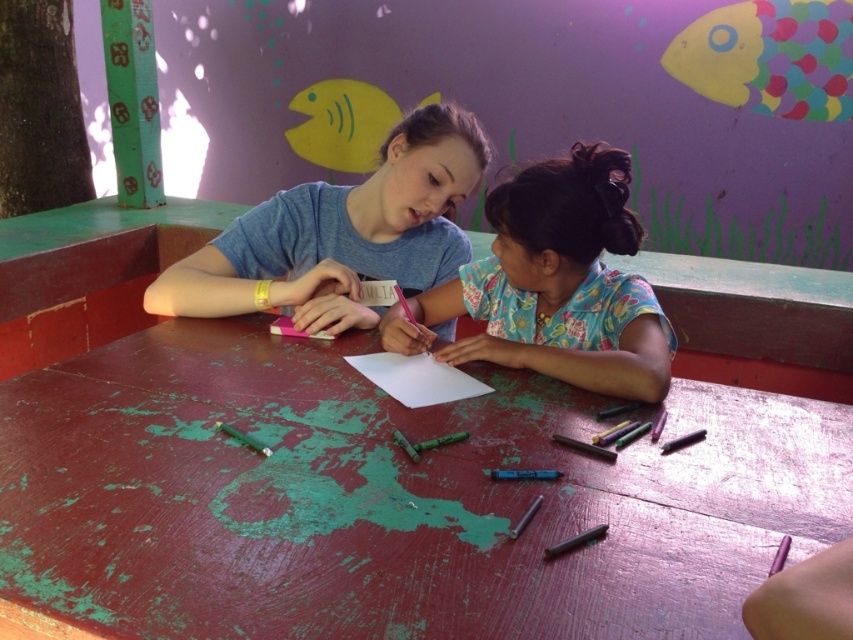
Is point (248, 456) closer to camera compared to point (352, 364)?

Yes, point (248, 456) is in front of point (352, 364).

You are a GUI agent. You are given a task and a screenshot of the screen. Output one action in this format:
    pyautogui.click(x=<x>, y=<y>)
    Task: Click on the rusty wood table at center
    
    Given the screenshot: What is the action you would take?
    pyautogui.click(x=387, y=499)

Locate an element on the screen. The width and height of the screenshot is (853, 640). rusty wood table at center is located at coordinates (387, 499).

In the scene shown: Does rusty wood table at center have a smaller size compared to floral fabric shirt at center?

Actually, rusty wood table at center might be larger than floral fabric shirt at center.

Is rusty wood table at center shorter than floral fabric shirt at center?

Yes, rusty wood table at center is shorter than floral fabric shirt at center.

Where is `rusty wood table at center`? The height and width of the screenshot is (640, 853). rusty wood table at center is located at coordinates (387, 499).

At what (x,y) coordinates should I click in order to perform the action: click on rusty wood table at center. Please return your answer as a coordinate pair (x, y). Looking at the image, I should click on (387, 499).

Between matte blue shirt at center and white paper at center, which one has less height?

white paper at center

Does matte blue shirt at center appear on the left side of white paper at center?

Correct, you'll find matte blue shirt at center to the left of white paper at center.

Who is more forward, (405, 216) or (473, 388)?

Point (473, 388) is in front.

At what (x,y) coordinates should I click in order to perform the action: click on matte blue shirt at center. Please return your answer as a coordinate pair (x, y). The height and width of the screenshot is (640, 853). Looking at the image, I should click on (341, 234).